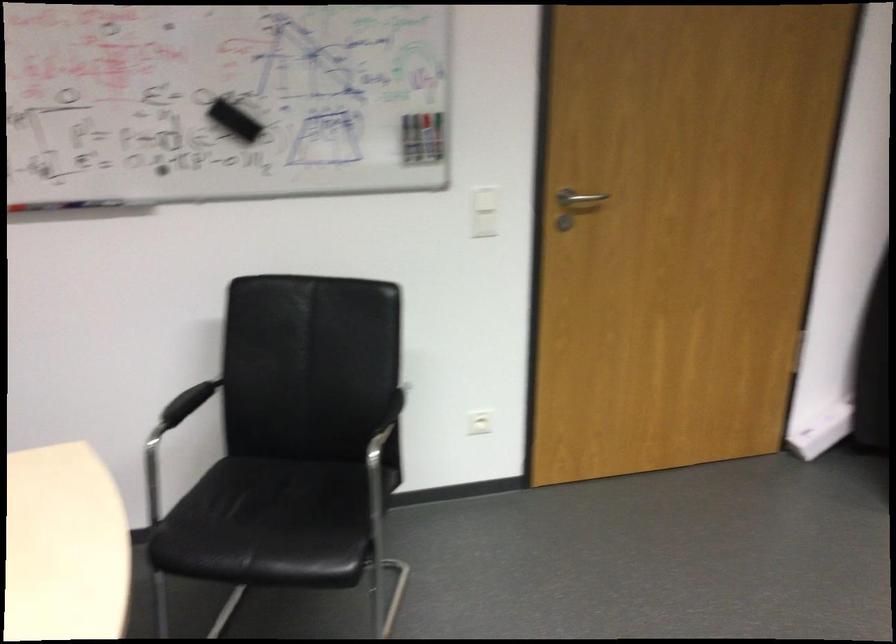
Find where to sitting on the black chair sitting surface. Please return your answer as a coordinate pair (x, y).

(265, 500)